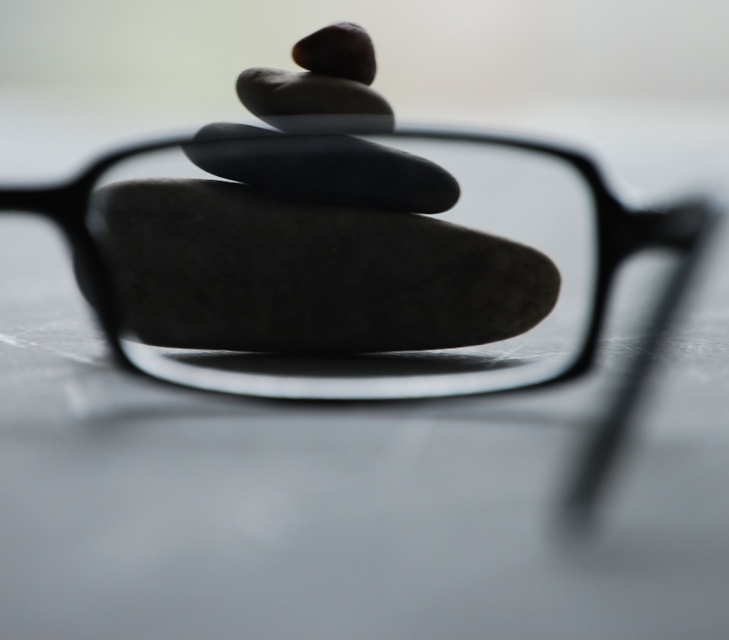
Question: Among these points, which one is farthest from the camera?

Choices:
 (A) (662, 291)
 (B) (295, 221)

Answer: (A)

Question: Is black matte glasses at center smaller than smooth gray rock at center?

Choices:
 (A) yes
 (B) no

Answer: (B)

Question: Is black matte glasses at center smaller than smooth gray rock at center?

Choices:
 (A) no
 (B) yes

Answer: (A)

Question: Does black matte glasses at center appear on the left side of smooth gray rock at center?

Choices:
 (A) no
 (B) yes

Answer: (A)